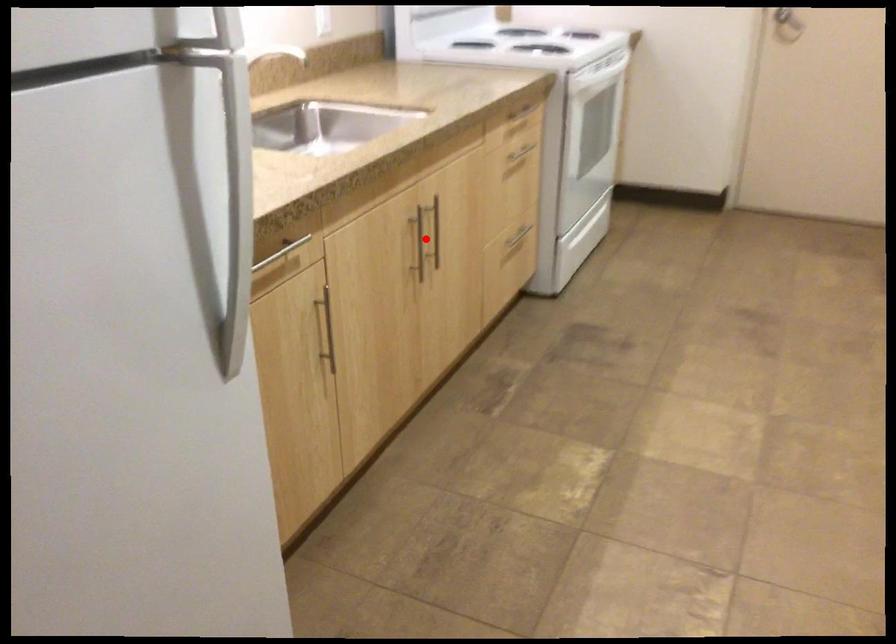
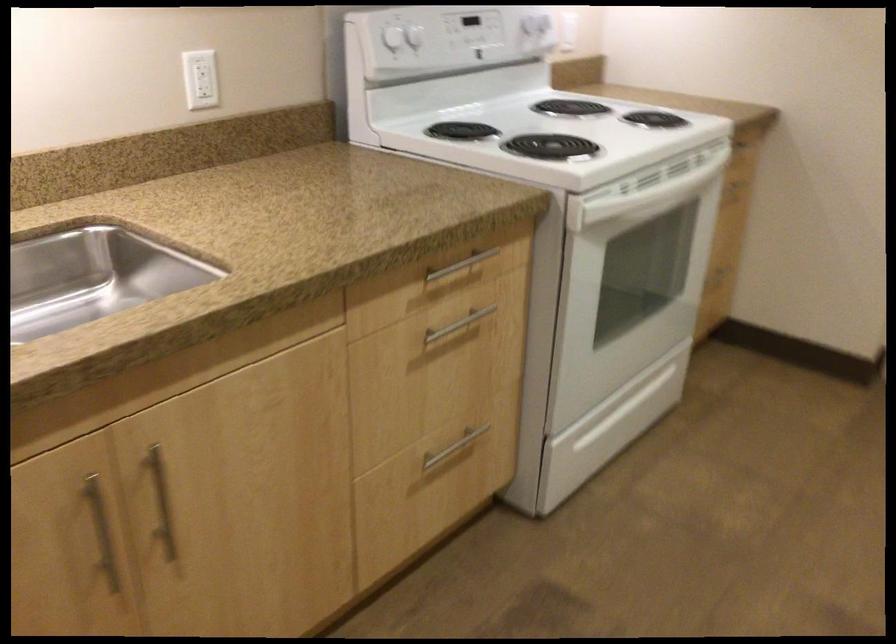
Question: I am providing you with two images of the same scene from different viewpoints. In image1, a red point is highlighted. Considering the same 3D point in image2, which of the following is correct?

Choices:
 (A) It is closer
 (B) It is farther

Answer: (A)